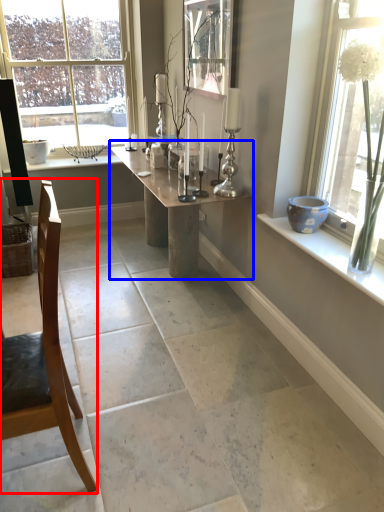
Question: Which object is closer to the camera taking this photo, chair (highlighted by a red box) or table (highlighted by a blue box)?

Choices:
 (A) chair
 (B) table

Answer: (A)